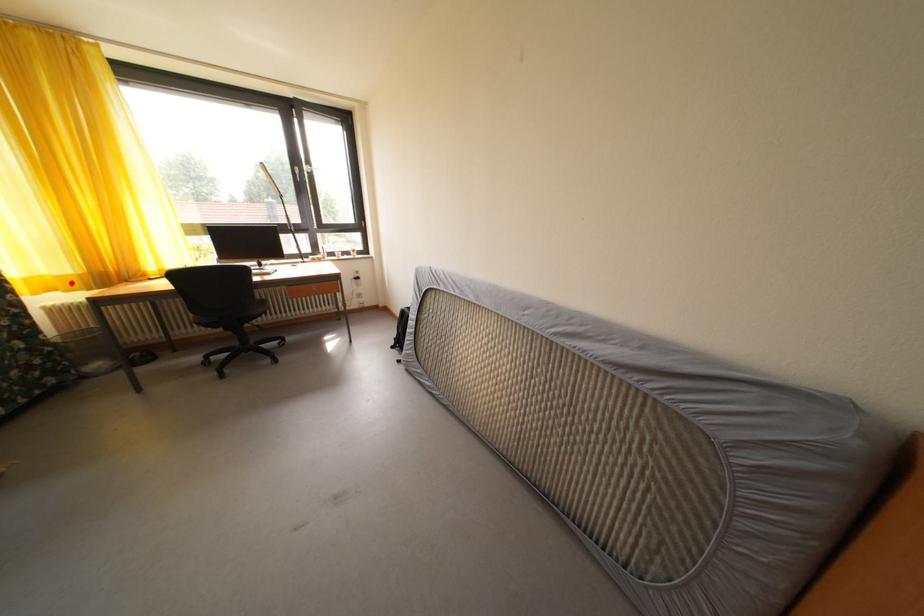
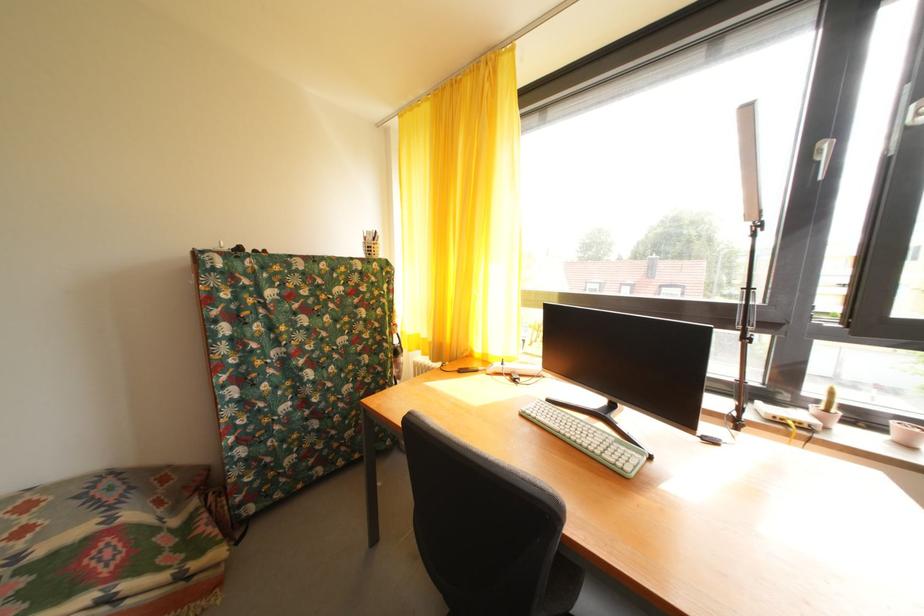
Question: I am providing you with two images of the same scene from different viewpoints. A red point is shown in image1. For the corresponding object point in image2, is it positioned nearer or farther from the camera?

Choices:
 (A) Nearer
 (B) Farther

Answer: (A)